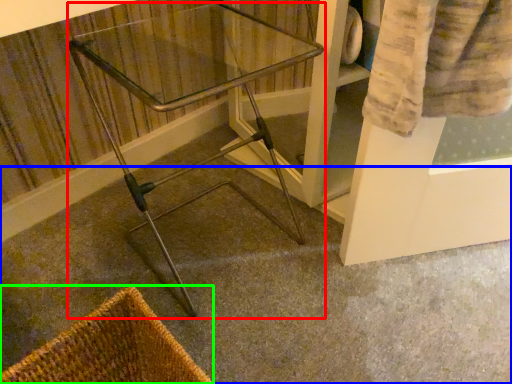
Question: Which object is positioned closest to furniture (highlighted by a red box)? Select from concrete (highlighted by a blue box) and basket (highlighted by a green box).

Choices:
 (A) concrete
 (B) basket

Answer: (A)